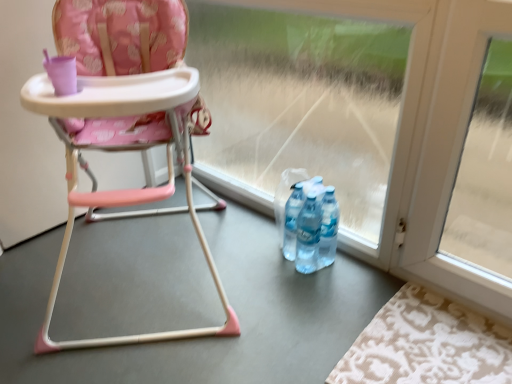
I want to click on vacant space in front of transparent glass door at center, so click(x=298, y=301).